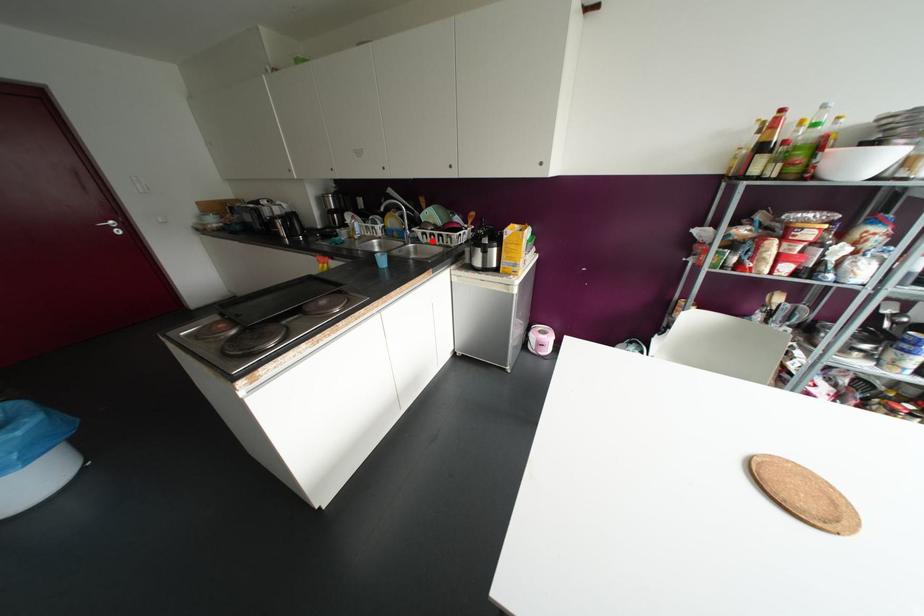
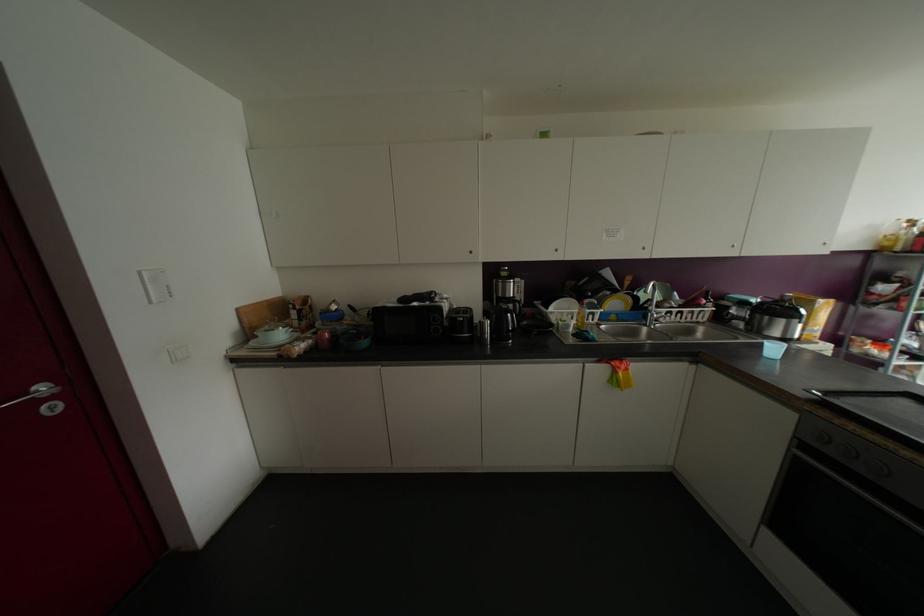
Where in the second image is the point corresponding to the highlighted location from the first image?

(677, 318)